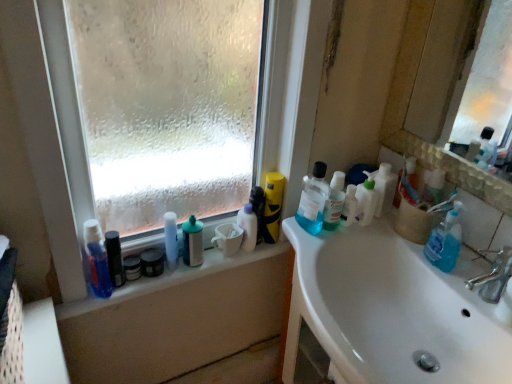
Question: Is the position of blue glossy lotion at left, which is the 8th toiletry in right-to-left order, more distant than that of translucent plastic bottle at center, which is counted as the fifth toiletry, starting from the left?

Choices:
 (A) yes
 (B) no

Answer: (B)

Question: Can you confirm if blue glossy lotion at left, which is counted as the 1th toiletry, starting from the left, is smaller than translucent plastic bottle at center, which is counted as the fifth toiletry, starting from the left?

Choices:
 (A) no
 (B) yes

Answer: (A)

Question: Are blue glossy lotion at left, which is the 8th toiletry in right-to-left order, and translucent plastic bottle at center, acting as the 4th toiletry starting from the right, located far from each other?

Choices:
 (A) no
 (B) yes

Answer: (A)

Question: Does blue glossy lotion at left, which is counted as the 1th toiletry, starting from the left, have a larger size compared to translucent plastic bottle at center, acting as the 4th toiletry starting from the right?

Choices:
 (A) no
 (B) yes

Answer: (B)

Question: Does blue glossy lotion at left, which is the 8th toiletry in right-to-left order, appear on the left side of translucent plastic bottle at center, acting as the 4th toiletry starting from the right?

Choices:
 (A) no
 (B) yes

Answer: (B)

Question: Is translucent plastic bottle at center, which is counted as the fifth toiletry, starting from the left, at the back of blue glossy lotion at left, which is counted as the 1th toiletry, starting from the left?

Choices:
 (A) yes
 (B) no

Answer: (B)

Question: Does yellow matte cylindrical container at center, the sixth toiletry positioned from the left, touch translucent plastic bottle at center, acting as the 4th toiletry starting from the right?

Choices:
 (A) no
 (B) yes

Answer: (B)

Question: Can you confirm if yellow matte cylindrical container at center, the sixth toiletry positioned from the left, is thinner than translucent plastic bottle at center, acting as the 4th toiletry starting from the right?

Choices:
 (A) yes
 (B) no

Answer: (A)

Question: Does yellow matte cylindrical container at center, which ranks as the 3th toiletry in right-to-left order, come behind translucent plastic bottle at center, which is counted as the fifth toiletry, starting from the left?

Choices:
 (A) yes
 (B) no

Answer: (B)

Question: Is yellow matte cylindrical container at center, which ranks as the 3th toiletry in right-to-left order, closer to camera compared to translucent plastic bottle at center, which is counted as the fifth toiletry, starting from the left?

Choices:
 (A) yes
 (B) no

Answer: (A)

Question: Does yellow matte cylindrical container at center, which ranks as the 3th toiletry in right-to-left order, appear on the left side of translucent plastic bottle at center, which is counted as the fifth toiletry, starting from the left?

Choices:
 (A) no
 (B) yes

Answer: (A)

Question: Does yellow matte cylindrical container at center, the sixth toiletry positioned from the left, have a greater width compared to translucent plastic bottle at center, acting as the 4th toiletry starting from the right?

Choices:
 (A) no
 (B) yes

Answer: (A)

Question: Can you confirm if white glossy bottle at center, which is the 3th toiletry in left-to-right order, is positioned to the left of silver metallic faucet at sink right?

Choices:
 (A) no
 (B) yes

Answer: (B)